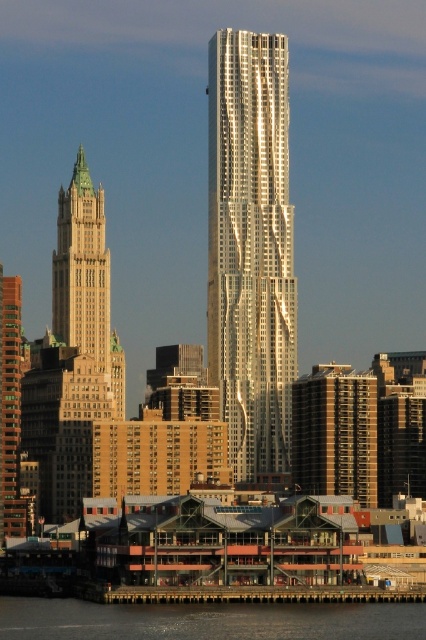
Which is in front, point (48, 602) or point (17, 333)?

Positioned in front is point (17, 333).

Is transparent water at lower center thinner than brown brick building at left?

In fact, transparent water at lower center might be wider than brown brick building at left.

You are a GUI agent. You are given a task and a screenshot of the screen. Output one action in this format:
    pyautogui.click(x=<x>, y=<y>)
    Task: Click on the transparent water at lower center
    
    Given the screenshot: What is the action you would take?
    coord(207,620)

Can you confirm if shiny metallic skyscraper at center is positioned to the right of brown brick building at left?

Indeed, shiny metallic skyscraper at center is positioned on the right side of brown brick building at left.

Does point (244, 333) come in front of point (2, 515)?

Yes, it is in front of point (2, 515).

Locate an element on the screen. The image size is (426, 640). shiny metallic skyscraper at center is located at coordinates (250, 248).

Is shiny metallic skyscraper at center behind gold textured building at left?

No, shiny metallic skyscraper at center is in front of gold textured building at left.

Between shiny metallic skyscraper at center and gold textured building at left, which one is positioned lower?

gold textured building at left is lower down.

What do you see at coordinates (250, 248) in the screenshot? I see `shiny metallic skyscraper at center` at bounding box center [250, 248].

Find the location of a particular element. This screenshot has height=640, width=426. shiny metallic skyscraper at center is located at coordinates (x=250, y=248).